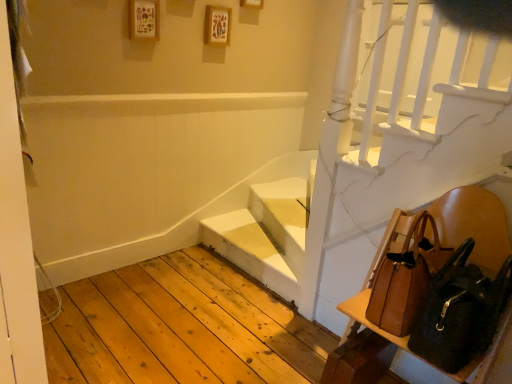
Question: Should I look upward or downward to see brown leather chair at lower right?

Choices:
 (A) up
 (B) down

Answer: (B)

Question: Is brown leather shoulder bag at lower right, acting as the 2th shoulder bag starting from the back, surrounded by brown leather chair at lower right?

Choices:
 (A) yes
 (B) no

Answer: (A)

Question: Considering the relative positions of brown leather chair at lower right and brown leather shoulder bag at lower right, acting as the 2th shoulder bag starting from the back, in the image provided, is brown leather chair at lower right to the left of brown leather shoulder bag at lower right, acting as the 2th shoulder bag starting from the back, from the viewer's perspective?

Choices:
 (A) yes
 (B) no

Answer: (A)

Question: From a real-world perspective, does brown leather chair at lower right sit lower than brown leather shoulder bag at lower right, acting as the 2th shoulder bag starting from the back?

Choices:
 (A) yes
 (B) no

Answer: (A)

Question: Is brown leather chair at lower right bigger than brown leather shoulder bag at lower right, acting as the 2th shoulder bag starting from the back?

Choices:
 (A) no
 (B) yes

Answer: (B)

Question: Is brown leather chair at lower right turned away from brown leather shoulder bag at lower right, acting as the 2th shoulder bag starting from the back?

Choices:
 (A) no
 (B) yes

Answer: (B)

Question: Is brown leather chair at lower right positioned far away from brown leather shoulder bag at lower right, the first shoulder bag viewed from the front?

Choices:
 (A) no
 (B) yes

Answer: (A)

Question: Would you say white matte stairs at center is outside brown leather shoulder bag at right, which ranks as the 1th shoulder bag in back-to-front order?

Choices:
 (A) yes
 (B) no

Answer: (A)

Question: Does white matte stairs at center appear on the left side of brown leather shoulder bag at right, which ranks as the 1th shoulder bag in back-to-front order?

Choices:
 (A) no
 (B) yes

Answer: (B)

Question: Is white matte stairs at center behind brown leather shoulder bag at right, placed as the second shoulder bag when sorted from front to back?

Choices:
 (A) yes
 (B) no

Answer: (A)

Question: Is white matte stairs at center beside brown leather shoulder bag at right, placed as the second shoulder bag when sorted from front to back?

Choices:
 (A) yes
 (B) no

Answer: (B)

Question: Is white matte stairs at center oriented towards brown leather shoulder bag at right, placed as the second shoulder bag when sorted from front to back?

Choices:
 (A) yes
 (B) no

Answer: (B)

Question: Can you confirm if white matte stairs at center is thinner than brown leather shoulder bag at right, placed as the second shoulder bag when sorted from front to back?

Choices:
 (A) yes
 (B) no

Answer: (B)

Question: Is brown leather chair at lower right wider than brown leather shoulder bag at right, which ranks as the 1th shoulder bag in back-to-front order?

Choices:
 (A) no
 (B) yes

Answer: (B)